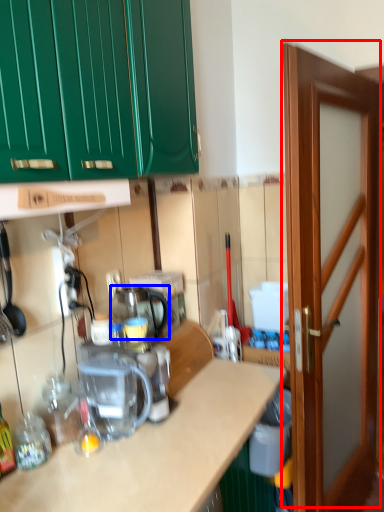
Question: Which point is closer to the camera, door (highlighted by a red box) or appliance (highlighted by a blue box)?

Choices:
 (A) door
 (B) appliance

Answer: (A)